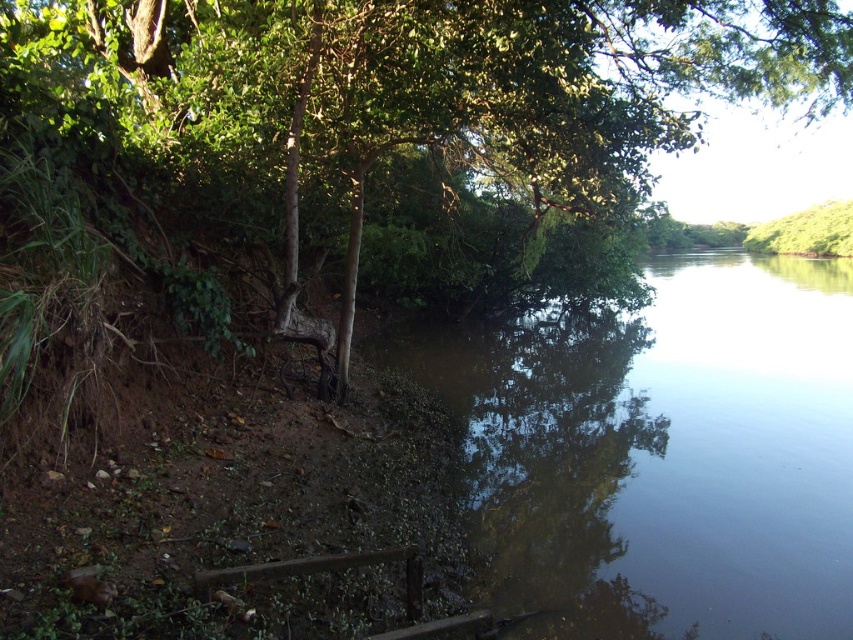
Looking at this image, you are standing at the edge of the river and want to reach the green leafy tree at left without getting your feet wet. The brown murky water at center is between you and the tree. Can you walk around the water to reach the tree?

The brown murky water at center is 18.08 feet away from the green leafy tree at left. Since the water is between you and the tree, you would need to walk around it. However, the distance provided doesn not indicate the width of the water area, so it is unclear if there is enough space to bypass it safely.

You are an environmental scientist assessing the health of a river. You observe the brown murky water at center and the green leafy tree at left in the scene. Which object occupies a wider area in the image?

The brown murky water at center occupies a wider area than the green leafy tree at left according to the description.